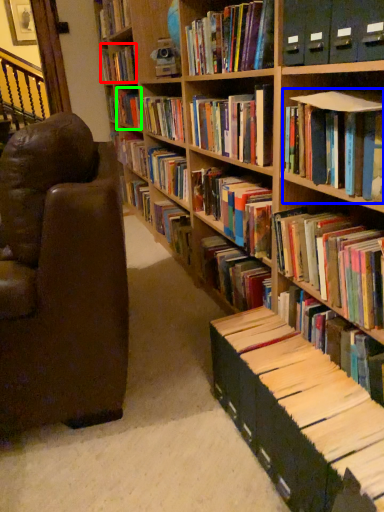
Question: Based on their relative distances, which object is farther from book (highlighted by a red box)? Choose from book (highlighted by a blue box) and book (highlighted by a green box).

Choices:
 (A) book
 (B) book

Answer: (A)